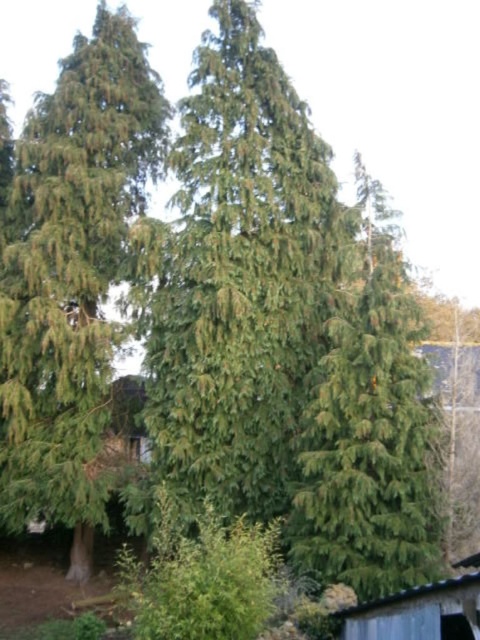
Question: Which point is farther to the camera?

Choices:
 (A) (85, 312)
 (B) (355, 634)

Answer: (A)

Question: From the image, what is the correct spatial relationship of green needle-like at left in relation to rusty corrugated metal hut at lower right?

Choices:
 (A) below
 (B) above

Answer: (B)

Question: Is green needle-like at left wider than rusty corrugated metal hut at lower right?

Choices:
 (A) yes
 (B) no

Answer: (A)

Question: Which point is closer to the camera?

Choices:
 (A) green needle-like at left
 (B) rusty corrugated metal hut at lower right

Answer: (B)

Question: Is green needle-like at left further to camera compared to rusty corrugated metal hut at lower right?

Choices:
 (A) yes
 (B) no

Answer: (A)